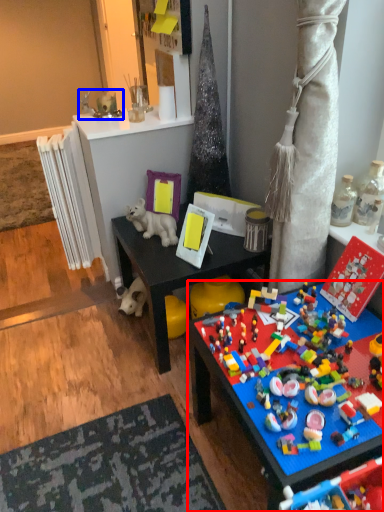
Question: Which object appears farthest to the camera in this image, toy (highlighted by a red box) or toy (highlighted by a blue box)?

Choices:
 (A) toy
 (B) toy

Answer: (B)